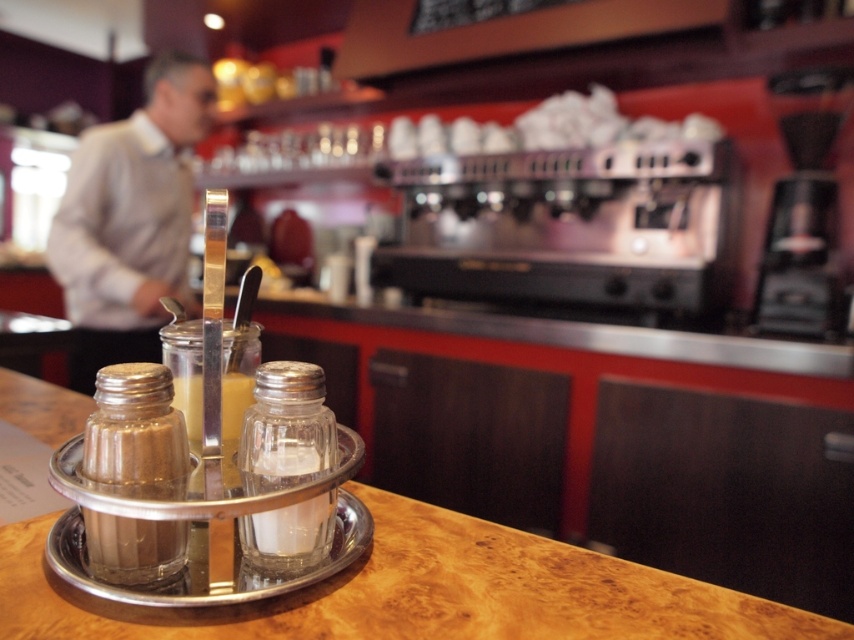
Does light gray shirt at left have a lesser height compared to black plastic coffee machine at right?

In fact, light gray shirt at left may be taller than black plastic coffee machine at right.

What do you see at coordinates (130, 220) in the screenshot? The image size is (854, 640). I see `light gray shirt at left` at bounding box center [130, 220].

Identify the location of light gray shirt at left. Image resolution: width=854 pixels, height=640 pixels. (130, 220).

Which of these two, silver metallic salt shaker at center or translucent glass bottle at center, stands taller?

Standing taller between the two is silver metallic salt shaker at center.

Consider the image. Measure the distance from silver metallic salt shaker at center to translucent glass bottle at center.

silver metallic salt shaker at center is 3.32 inches from translucent glass bottle at center.

The image size is (854, 640). I want to click on silver metallic salt shaker at center, so click(x=135, y=429).

Who is taller, clear glass salt shaker at center or translucent glass bottle at center?

clear glass salt shaker at center is taller.

Between clear glass salt shaker at center and translucent glass bottle at center, which one is positioned lower?

clear glass salt shaker at center

Is point (295, 525) less distant than point (221, 424)?

Yes, point (295, 525) is in front of point (221, 424).

The width and height of the screenshot is (854, 640). What are the coordinates of `clear glass salt shaker at center` in the screenshot? It's located at (285, 428).